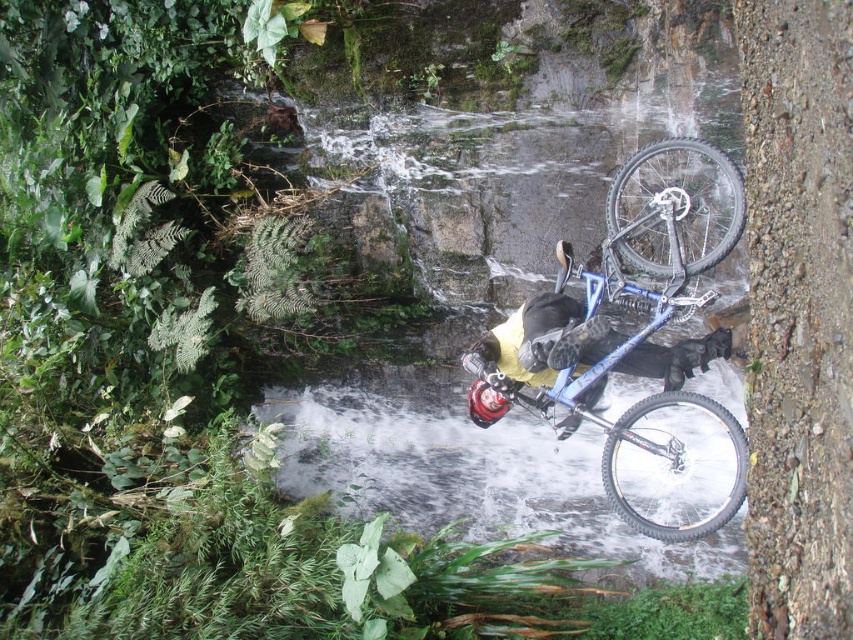
Between point (509, 392) and point (282, 406), which one is positioned in front?

Positioned in front is point (509, 392).

Does blue metallic mountain bike at center appear on the left side of clear water at center?

Incorrect, blue metallic mountain bike at center is not on the left side of clear water at center.

Who is more forward, (659, 364) or (543, 160)?

Point (659, 364) is in front.

Image resolution: width=853 pixels, height=640 pixels. I want to click on blue metallic mountain bike at center, so click(637, 342).